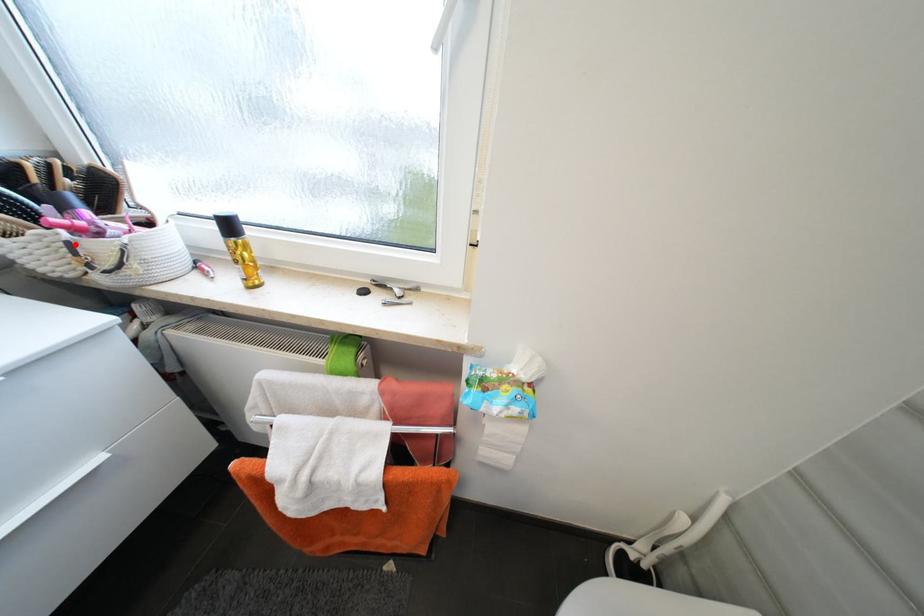
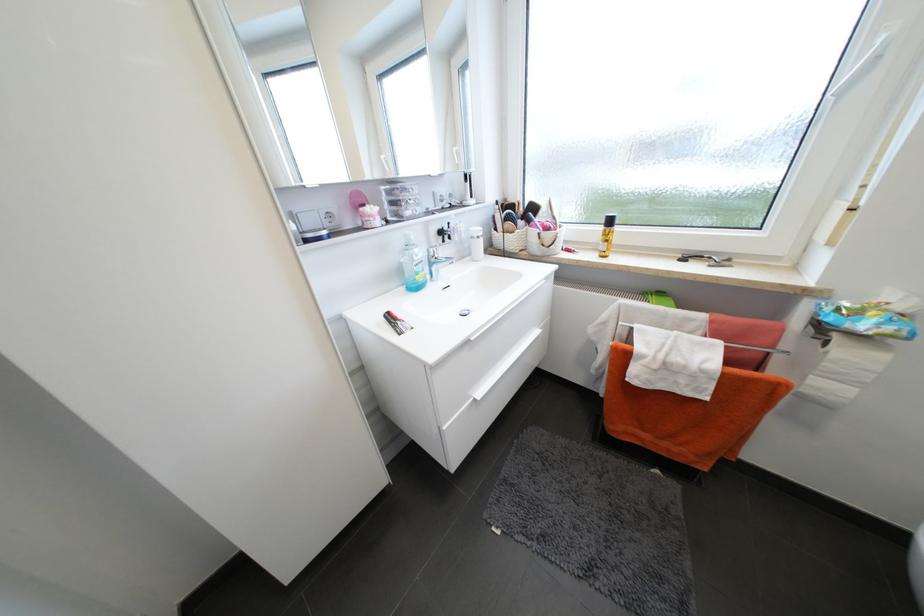
Question: I am providing you with two images of the same scene from different viewpoints. In image1, a red point is highlighted. Considering the same 3D point in image2, which of the following is correct?

Choices:
 (A) It is closer
 (B) It is farther

Answer: (A)